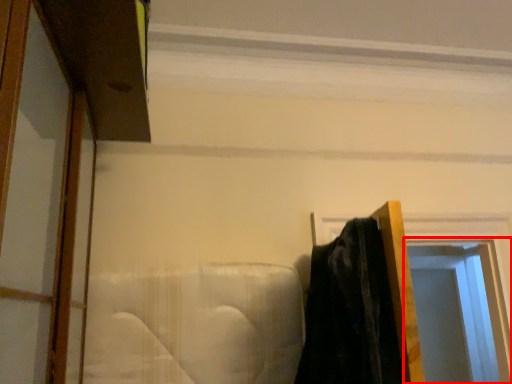
Question: Considering the relative positions of window (annotated by the red box) and window frame in the image provided, where is window (annotated by the red box) located with respect to the staircase?

Choices:
 (A) left
 (B) right

Answer: (B)